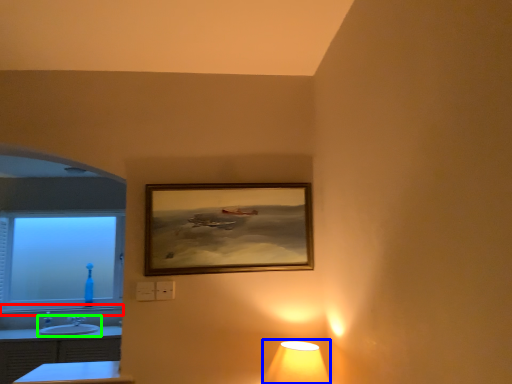
Question: Estimate the real-world distances between objects in this image. Which object is farther from window sill (highlighted by a red box), lamp (highlighted by a blue box) or sink (highlighted by a green box)?

Choices:
 (A) lamp
 (B) sink

Answer: (A)